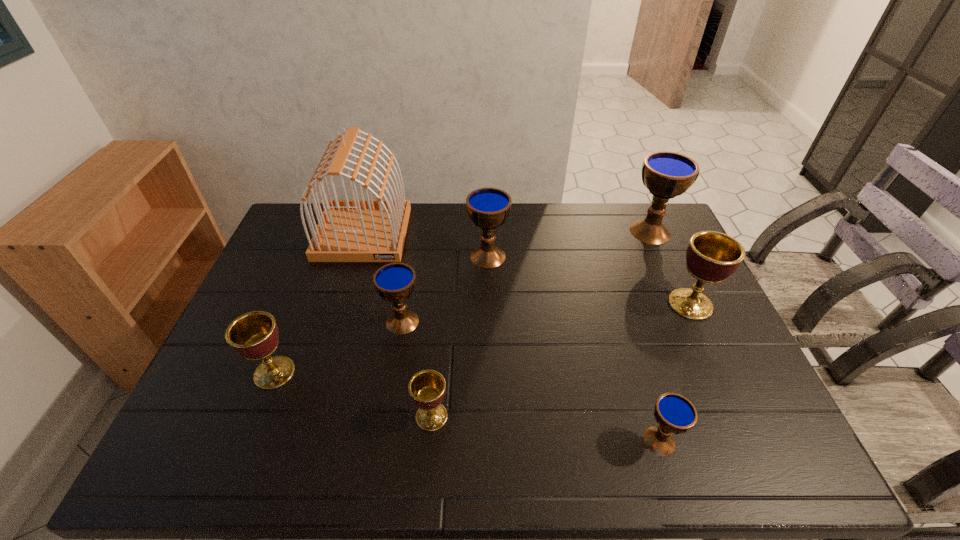
Select which blue chalice is the fourth closest to the tallest object. Please provide its 2D coordinates. Your answer should be formatted as a tuple, i.e. [(x, y)], where the tuple contains the x and y coordinates of a point satisfying the conditions above.

[(674, 413)]

Locate which golden chalice is the third closest to the smallest blue chalice. Please provide its 2D coordinates. Your answer should be formatted as a tuple, i.e. [(x, y)], where the tuple contains the x and y coordinates of a point satisfying the conditions above.

[(254, 335)]

Locate which golden chalice is the second closest to the tallest object. Please provide its 2D coordinates. Your answer should be formatted as a tuple, i.e. [(x, y)], where the tuple contains the x and y coordinates of a point satisfying the conditions above.

[(427, 388)]

Where is `vacant point that satisfies the following two spatial constraints: 1. on the back side of the second nearest blue chalice; 2. on the left side of the farthest golden chalice`? vacant point that satisfies the following two spatial constraints: 1. on the back side of the second nearest blue chalice; 2. on the left side of the farthest golden chalice is located at coordinates (405, 304).

This screenshot has height=540, width=960. I want to click on free space that satisfies the following two spatial constraints: 1. with an open door on the beige birdcage; 2. on the left side of the third chalice from right to left, so click(300, 441).

The image size is (960, 540). Identify the location of vacant space that satisfies the following two spatial constraints: 1. with an open door on the rightmost golden chalice; 2. on the right side of the tallest object. (342, 304).

The image size is (960, 540). In order to click on free space that satisfies the following two spatial constraints: 1. with an open door on the third blue chalice from right to left; 2. on the right side of the birdcage in this screenshot , I will do `click(356, 256)`.

Where is `free spot that satisfies the following two spatial constraints: 1. on the front side of the fourth object from left to right; 2. on the left side of the second blue chalice from right to left`? This screenshot has height=540, width=960. free spot that satisfies the following two spatial constraints: 1. on the front side of the fourth object from left to right; 2. on the left side of the second blue chalice from right to left is located at coordinates (429, 441).